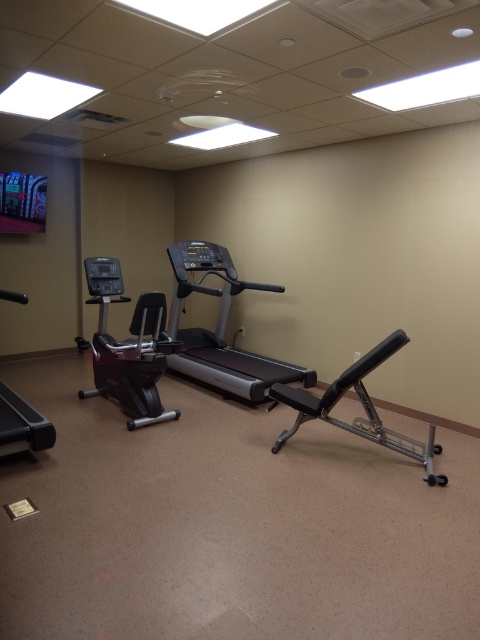
Question: Which point appears closest to the camera in this image?

Choices:
 (A) (99, 266)
 (B) (12, 424)
 (C) (392, 435)

Answer: (B)

Question: Which of the following is the farthest from the observer?

Choices:
 (A) (6, 449)
 (B) (134, 316)
 (C) (429, 483)

Answer: (B)

Question: Can you confirm if black matte exercise bike at left is positioned to the left of black rubber treadmill at left?

Choices:
 (A) yes
 (B) no

Answer: (B)

Question: In this image, where is black matte exercise bike at left located relative to silver metallic weight bench at center?

Choices:
 (A) below
 (B) above

Answer: (B)

Question: Which point appears farthest from the camera in this image?

Choices:
 (A) click(232, 364)
 (B) click(360, 396)

Answer: (A)

Question: Is black matte exercise bike at left to the right of black rubber treadmill at left from the viewer's perspective?

Choices:
 (A) yes
 (B) no

Answer: (A)